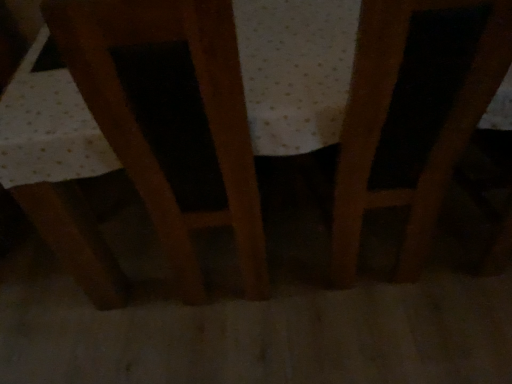
This screenshot has height=384, width=512. In order to click on vacant area that is in front of wooden swivel chair at center in this screenshot , I will do `click(256, 348)`.